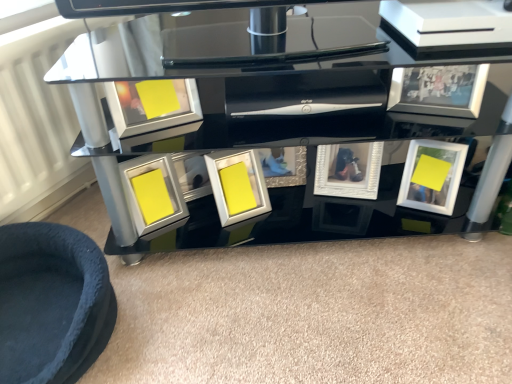
Find the location of a particular element. Image resolution: width=512 pixels, height=384 pixels. free space between white textured frame at center, acting as the 3th picture frame starting from the right, and velvet blue pet bed at lower left is located at coordinates (229, 266).